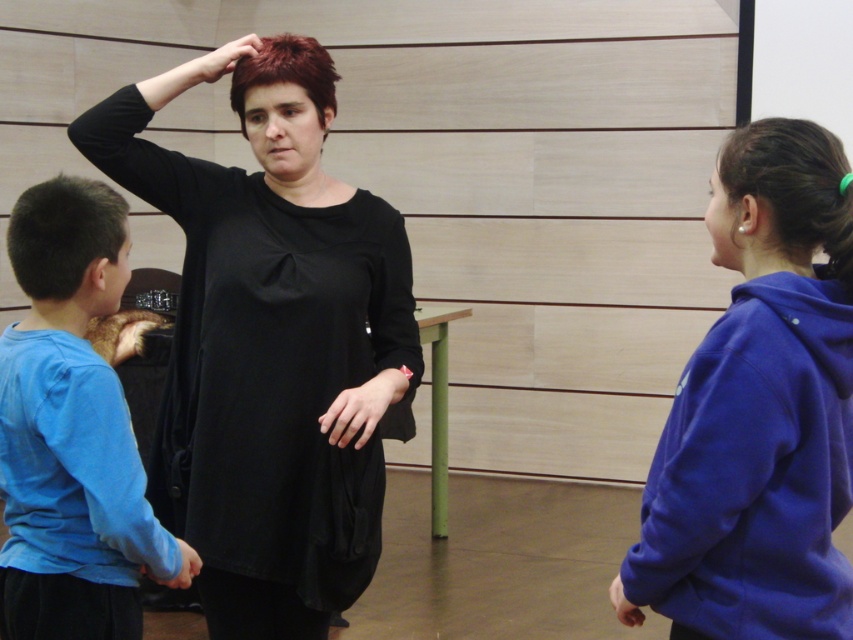
You are a photographer adjusting your camera settings. You notice two hands in the scene, the matte black hand at center and the matte skin hand at lower center. Which hand is closer to your camera lens?

The matte black hand at center is closer to the camera lens because it is described as further to the viewer than the matte skin hand at lower center.

In the scene described, where is the matte black hand at center located in terms of coordinates?

The matte black hand at center is located at coordinates point (361, 406).

You are a photographer setting up for a group photo. You need to position two subjects so that they are exactly 4 feet apart. The blue cotton shirt at left and dark brown shiny hair at right are currently positioned at 3.89 feet apart. Can they move closer or farther to achieve the desired distance?

The current distance between the blue cotton shirt at left and dark brown shiny hair at right is 3.89 feet, which is 0.11 feet less than the required 4 feet. They need to move slightly farther apart to reach the desired distance.